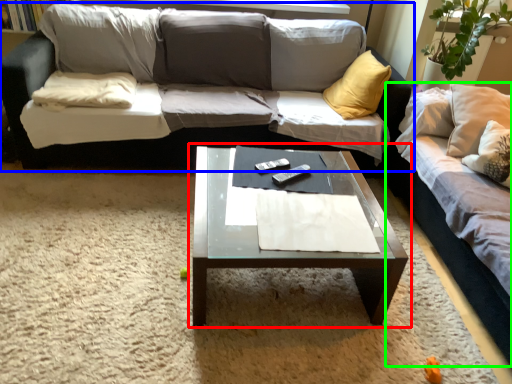
Question: Which object is positioned farthest from coffee table (highlighted by a red box)? Select from studio couch (highlighted by a blue box) and studio couch (highlighted by a green box).

Choices:
 (A) studio couch
 (B) studio couch

Answer: (A)